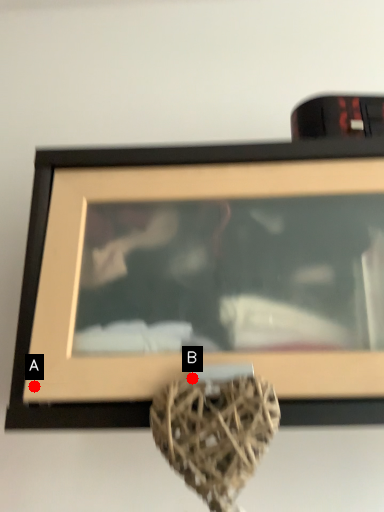
Question: Two points are circled on the image, labeled by A and B beside each circle. Which point appears closest to the camera in this image?

Choices:
 (A) A is closer
 (B) B is closer

Answer: (B)